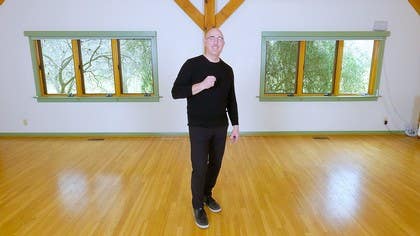
Where is `white wall in the back`? The image size is (420, 236). white wall in the back is located at coordinates (172, 44).